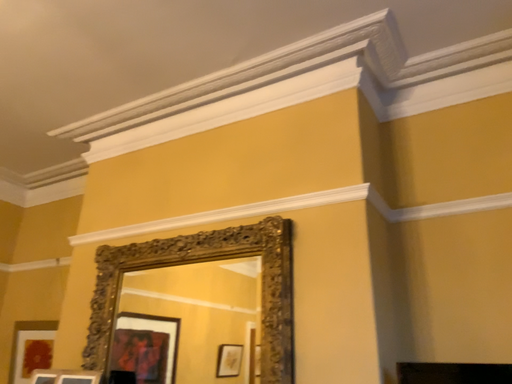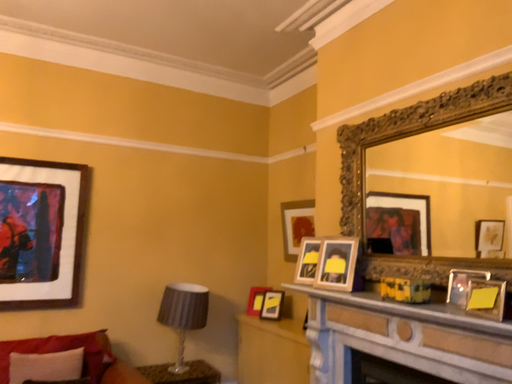
Question: Which way did the camera rotate in the video?

Choices:
 (A) rotated upward
 (B) rotated downward

Answer: (B)